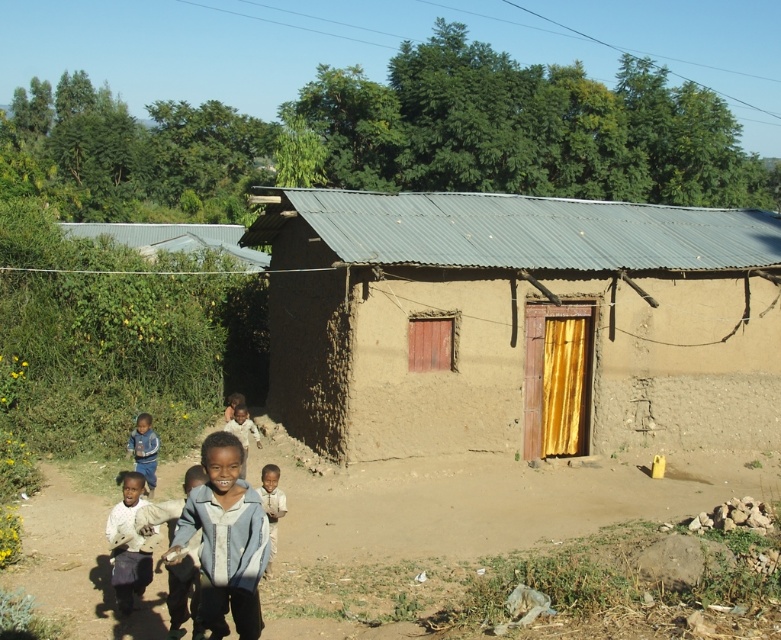
Measure the distance from light blue denim jacket at lower center to blue denim jacket at lower left.

light blue denim jacket at lower center and blue denim jacket at lower left are 6.97 meters apart from each other.

Based on the photo, is light blue denim jacket at lower center closer to camera compared to blue denim jacket at lower left?

That is True.

Does point (230, 588) lie in front of point (130, 438)?

Yes, it is.

Where is `light blue denim jacket at lower center`? The width and height of the screenshot is (781, 640). light blue denim jacket at lower center is located at coordinates (225, 540).

Can you confirm if light gray cotton shirt at lower left is shorter than light brown skin at center?

No, light gray cotton shirt at lower left is not shorter than light brown skin at center.

This screenshot has width=781, height=640. Describe the element at coordinates (127, 545) in the screenshot. I see `light gray cotton shirt at lower left` at that location.

Locate an element on the screen. This screenshot has height=640, width=781. light gray cotton shirt at lower left is located at coordinates (127, 545).

Who is lower down, blue denim jacket at lower left or light brown skin at lower center?

light brown skin at lower center is below.

Does blue denim jacket at lower left have a smaller size compared to light brown skin at lower center?

Actually, blue denim jacket at lower left might be larger than light brown skin at lower center.

Between point (152, 440) and point (275, 483), which one is positioned behind?

Point (152, 440)

I want to click on blue denim jacket at lower left, so click(x=144, y=449).